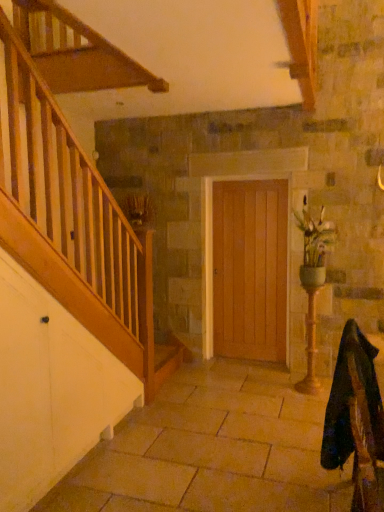
Locate an element on the screen. The image size is (384, 512). vacant area that lies in front of wooden door at center is located at coordinates (256, 374).